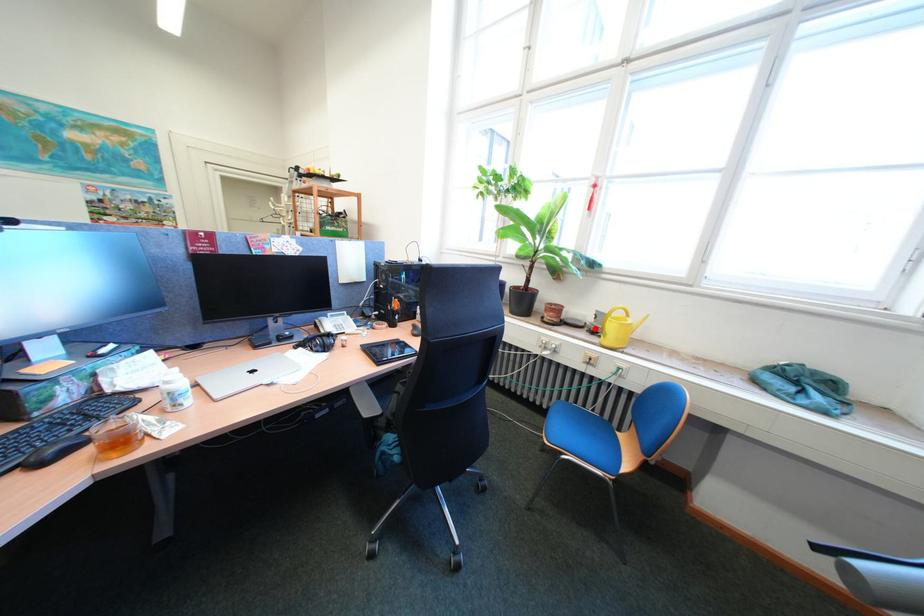
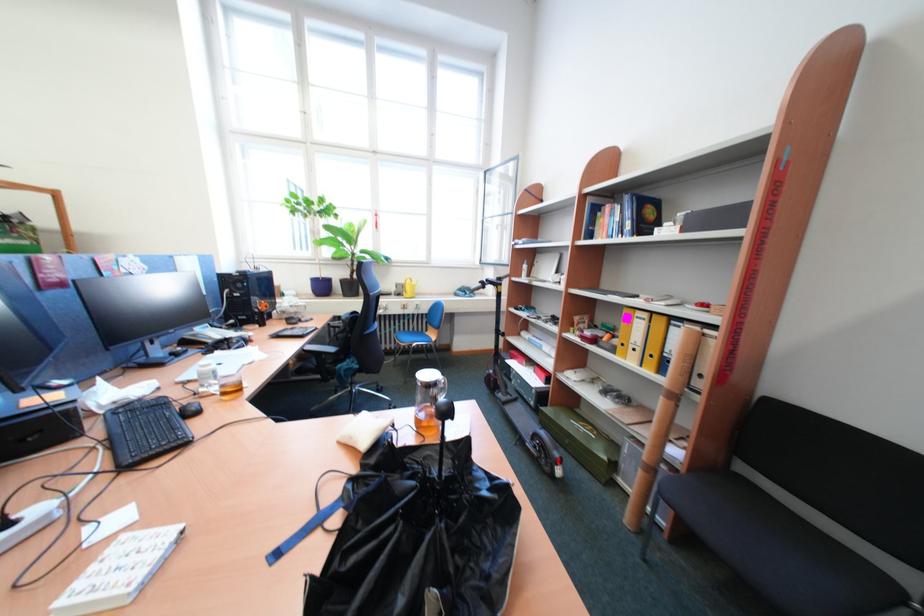
Question: I am providing you with two images of the same scene from different viewpoints. A red point is marked on the first image. Is the red point's position out of view in image 2?

Choices:
 (A) Yes
 (B) No

Answer: (B)